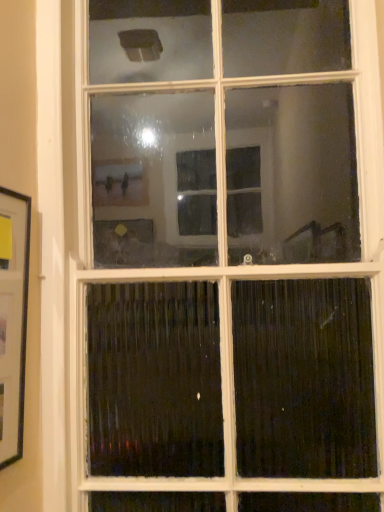
What do you see at coordinates (13, 319) in the screenshot?
I see `black matte picture frame at left` at bounding box center [13, 319].

Locate an element on the screen. This screenshot has width=384, height=512. black matte picture frame at left is located at coordinates (13, 319).

Find the location of a particular element. black matte picture frame at left is located at coordinates 13,319.